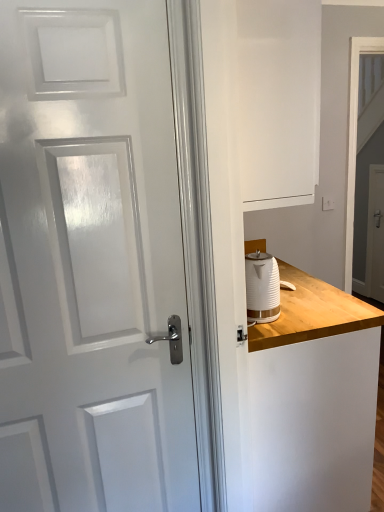
This screenshot has width=384, height=512. Describe the element at coordinates (354, 141) in the screenshot. I see `white glossy screen door at upper right, positioned as the second screen door in right-to-left order` at that location.

Where is `wooden counter at right`? wooden counter at right is located at coordinates (314, 399).

Locate an element on the screen. white ribbed kettle at right is located at coordinates (262, 287).

Is white ribbed kettle at right smaller than wooden counter at right?

Indeed, white ribbed kettle at right has a smaller size compared to wooden counter at right.

How different are the orientations of white ribbed kettle at right and wooden counter at right in degrees?

There is a 0.00151-degree angle between the facing directions of white ribbed kettle at right and wooden counter at right.

Considering the positions of objects white ribbed kettle at right and wooden counter at right in the image provided, who is more to the left, white ribbed kettle at right or wooden counter at right?

Positioned to the left is white ribbed kettle at right.

Is the position of white ribbed kettle at right less distant than that of wooden counter at right?

No, white ribbed kettle at right is behind wooden counter at right.

Considering the positions of objects white glossy screen door at upper right, the second screen door positioned from the back, and white glossy door at left in the image provided, who is more to the right, white glossy screen door at upper right, the second screen door positioned from the back, or white glossy door at left?

Positioned to the right is white glossy screen door at upper right, the second screen door positioned from the back.

Does point (350, 264) come behind point (116, 181)?

Yes.

From the image's perspective, between white glossy screen door at upper right, marked as the first screen door in a front-to-back arrangement, and white glossy door at left, who is located below?

white glossy door at left.

Is white glossy screen door at upper right, positioned as the second screen door in right-to-left order, bigger or smaller than white glossy door at left?

In the image, white glossy screen door at upper right, positioned as the second screen door in right-to-left order, appears to be smaller than white glossy door at left.

Considering the points (38, 44) and (320, 500), which point is in front, point (38, 44) or point (320, 500)?

The point (38, 44) is more forward.

Is wooden counter at right at the back of white glossy door at left?

That's not correct — white glossy door at left is not looking away from wooden counter at right.

Is white glossy door at left in front of wooden counter at right?

Yes, white glossy door at left is in front of wooden counter at right.

From the image's perspective, between white glossy door at left and wooden counter at right, who is located below?

wooden counter at right is shown below in the image.

Is white glossy screen door at upper right, which is counted as the 1th screen door, starting from the left, positioned with its back to white matte dresser at right?

No, white glossy screen door at upper right, which is counted as the 1th screen door, starting from the left, is not facing the opposite direction of white matte dresser at right.

Considering the positions of point (355, 53) and point (290, 418), is point (355, 53) closer or farther from the camera than point (290, 418)?

Point (355, 53) is farther from the camera than point (290, 418).

Would you say white glossy screen door at upper right, which is counted as the 1th screen door, starting from the left, is outside white matte dresser at right?

Yes, white glossy screen door at upper right, which is counted as the 1th screen door, starting from the left, is not within white matte dresser at right.

Looking at this image, how different are the orientations of white glossy screen door at upper right, which is counted as the 1th screen door, starting from the left, and white matte dresser at right in degrees?

88.9 degrees.

Is white matte dresser at right behind white glossy door at left?

No, it is in front of white glossy door at left.

Which of these two, white matte dresser at right or white glossy door at left, stands shorter?

white matte dresser at right.

Are white matte dresser at right and white glossy door at left far apart?

No, white matte dresser at right is in close proximity to white glossy door at left.

Which object is further away from the camera, white glossy screen door at upper right, which is counted as the 1th screen door, starting from the left, or wooden counter at right?

white glossy screen door at upper right, which is counted as the 1th screen door, starting from the left.

From the image's perspective, which is below, white glossy screen door at upper right, the second screen door positioned from the back, or wooden counter at right?

wooden counter at right.

Is white glossy screen door at upper right, positioned as the second screen door in right-to-left order, placed right next to wooden counter at right?

No, white glossy screen door at upper right, positioned as the second screen door in right-to-left order, is not beside wooden counter at right.

Considering the positions of objects white glossy door at left and white matte dresser at right in the image provided, who is more to the right, white glossy door at left or white matte dresser at right?

white matte dresser at right.

From a real-world perspective, is white glossy door at left above or below white matte dresser at right?

white glossy door at left is situated lower than white matte dresser at right in the real world.

Which of these two, white glossy door at left or white matte dresser at right, is smaller?

Smaller between the two is white glossy door at left.

Considering the sizes of white glossy door at left and white matte dresser at right in the image, is white glossy door at left wider or thinner than white matte dresser at right?

In the image, white glossy door at left appears to be more narrow than white matte dresser at right.

This screenshot has height=512, width=384. What are the coordinates of `kitchen appliance above the wooden counter at right (from a real-world perspective)` in the screenshot? It's located at (262, 287).

From the image's perspective, which screen door is the 2nd one above the white glossy door at left? Please provide its 2D coordinates.

[(354, 141)]

Estimate the real-world distances between objects in this image. Which object is further from white glossy door at left, white matte dresser at right or white glossy screen door at upper right, which is counted as the 1th screen door, starting from the left?

The object further to white glossy door at left is white glossy screen door at upper right, which is counted as the 1th screen door, starting from the left.

When comparing their distances from white ribbed kettle at right, does white glossy screen door at upper right, the second screen door positioned from the back, or wooden counter at right seem further?

white glossy screen door at upper right, the second screen door positioned from the back, is further to white ribbed kettle at right.

Considering their positions, is white ribbed kettle at right positioned closer to white glossy screen door at right, the second screen door viewed from the left, than white glossy screen door at upper right, marked as the first screen door in a front-to-back arrangement?

The object closer to white glossy screen door at right, the second screen door viewed from the left, is white glossy screen door at upper right, marked as the first screen door in a front-to-back arrangement.

When comparing their distances from wooden counter at right, does white glossy screen door at right, which appears as the 2th screen door when viewed from the front, or white ribbed kettle at right seem further?

Among the two, white glossy screen door at right, which appears as the 2th screen door when viewed from the front, is located further to wooden counter at right.

Estimate the real-world distances between objects in this image. Which object is closer to white glossy screen door at upper right, positioned as the second screen door in right-to-left order, white matte dresser at right or white glossy door at left?

white matte dresser at right is positioned closer to the anchor white glossy screen door at upper right, positioned as the second screen door in right-to-left order.

Considering their positions, is white glossy screen door at right, which appears as the 2th screen door when viewed from the front, positioned further to white ribbed kettle at right than white matte dresser at right?

The object further to white ribbed kettle at right is white glossy screen door at right, which appears as the 2th screen door when viewed from the front.

Estimate the real-world distances between objects in this image. Which object is further from wooden counter at right, white ribbed kettle at right or white glossy screen door at right, which appears as the 2th screen door when viewed from the front?

white glossy screen door at right, which appears as the 2th screen door when viewed from the front, is further to wooden counter at right.

When comparing their distances from white ribbed kettle at right, does white glossy screen door at upper right, marked as the first screen door in a front-to-back arrangement, or white matte dresser at right seem closer?

The object closer to white ribbed kettle at right is white matte dresser at right.

Where is `screen door located between white ribbed kettle at right and white glossy screen door at right, acting as the first screen door starting from the back, in the depth direction`? The height and width of the screenshot is (512, 384). screen door located between white ribbed kettle at right and white glossy screen door at right, acting as the first screen door starting from the back, in the depth direction is located at coordinates (354, 141).

Where is `door between white matte dresser at right and white glossy screen door at upper right, which is counted as the 1th screen door, starting from the left, along the z-axis`? door between white matte dresser at right and white glossy screen door at upper right, which is counted as the 1th screen door, starting from the left, along the z-axis is located at coordinates pyautogui.click(x=91, y=263).

You are a GUI agent. You are given a task and a screenshot of the screen. Output one action in this format:
    pyautogui.click(x=<x>, y=<y>)
    Task: Click on the kitchen appliance between wooden counter at right and white glossy screen door at upper right, positioned as the second screen door in right-to-left order, from front to back
    This screenshot has width=384, height=512.
    Given the screenshot: What is the action you would take?
    pyautogui.click(x=262, y=287)

Where is `door between white matte dresser at right and wooden counter at right in the front-back direction`? door between white matte dresser at right and wooden counter at right in the front-back direction is located at coordinates (91, 263).